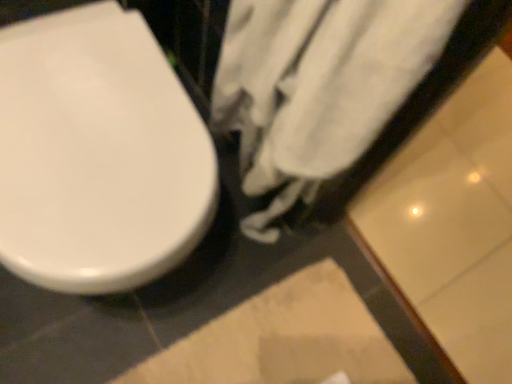
Question: In terms of size, does white cotton towel at center appear bigger or smaller than beige textured rug at lower center?

Choices:
 (A) big
 (B) small

Answer: (A)

Question: Visually, is white cotton towel at center positioned to the left or to the right of beige textured rug at lower center?

Choices:
 (A) right
 (B) left

Answer: (A)

Question: Which is farther from the white cotton towel at center?

Choices:
 (A) beige textured rug at lower center
 (B) white glossy toilet seat at left

Answer: (A)

Question: Considering the real-world distances, which object is farthest from the beige textured rug at lower center?

Choices:
 (A) white cotton towel at center
 (B) white glossy toilet seat at left

Answer: (B)